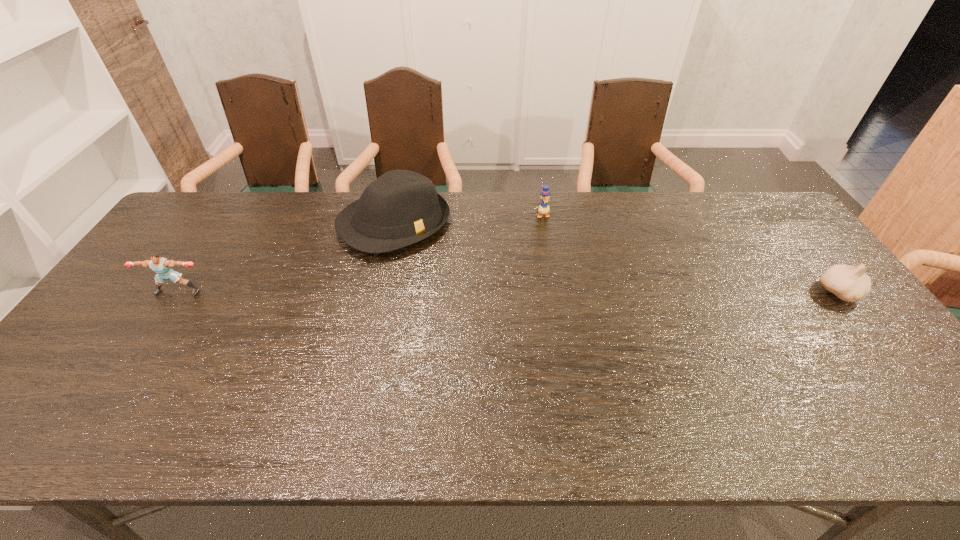
Find the location of a particular element. The height and width of the screenshot is (540, 960). vacant position located on the front-facing side of the second object from left to right is located at coordinates (x=499, y=317).

Locate an element on the screen. Image resolution: width=960 pixels, height=540 pixels. free spot located 0.260m on the front-facing side of the second object from left to right is located at coordinates (480, 300).

At what (x,y) coordinates should I click in order to perform the action: click on duckling situated at the far edge. Please return your answer as a coordinate pair (x, y). This screenshot has height=540, width=960. Looking at the image, I should click on (544, 208).

Identify the location of fedora located in the far edge section of the desktop. (401, 207).

This screenshot has width=960, height=540. Identify the location of object located at the left edge. (162, 266).

Image resolution: width=960 pixels, height=540 pixels. What are the coordinates of `object located in the right edge section of the desktop` in the screenshot? It's located at click(x=849, y=283).

Where is `vacant space at the far edge of the desktop`? This screenshot has height=540, width=960. vacant space at the far edge of the desktop is located at coordinates (554, 224).

I want to click on vacant space at the near edge of the desktop, so click(x=502, y=378).

You are a GUI agent. You are given a task and a screenshot of the screen. Output one action in this format:
    pyautogui.click(x=<x>, y=<y>)
    Task: Click on the vacant space at the left edge of the desktop
    
    Given the screenshot: What is the action you would take?
    pyautogui.click(x=89, y=334)

The image size is (960, 540). In order to click on vacant space at the right edge of the desktop in this screenshot , I will do [788, 237].